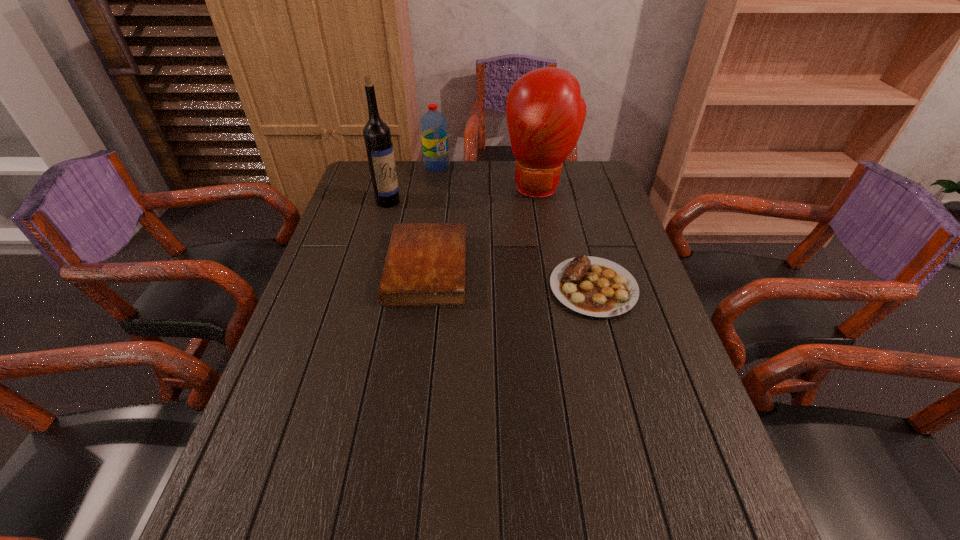
Locate an element on the screen. Image resolution: width=960 pixels, height=540 pixels. Bible is located at coordinates (425, 265).

At what (x,y) coordinates should I click in order to perform the action: click on steak. Please return your answer as a coordinate pair (x, y). The width and height of the screenshot is (960, 540). Looking at the image, I should click on (592, 286).

Where is `the leftmost object`? The width and height of the screenshot is (960, 540). the leftmost object is located at coordinates click(x=379, y=147).

Find the location of a particular element. This screenshot has width=960, height=540. boxing glove is located at coordinates (545, 113).

Locate an element on the screen. This screenshot has height=540, width=960. water bottle is located at coordinates (434, 133).

This screenshot has height=540, width=960. In order to click on free region located 0.110m on the spine side of the Bible in this screenshot , I will do tap(348, 268).

The width and height of the screenshot is (960, 540). Find the location of `vacant space located 0.050m on the spine side of the Bible`. vacant space located 0.050m on the spine side of the Bible is located at coordinates (370, 268).

Locate an element on the screen. vacant area located 0.170m on the spine side of the Bible is located at coordinates (327, 268).

This screenshot has width=960, height=540. I want to click on vacant area located on the front of the steak, so click(x=610, y=349).

Find the location of a particular element. The image size is (960, 540). vacant region located 0.180m on the label of the wine bottle is located at coordinates (427, 231).